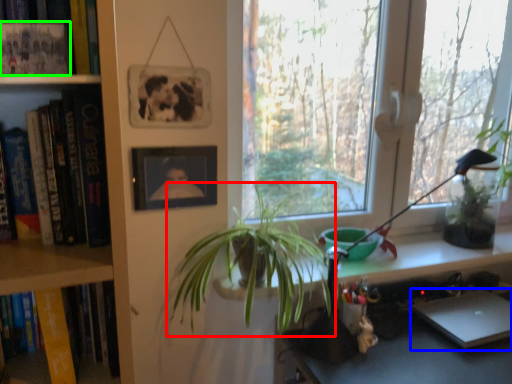
Question: Which object is the closest to the houseplant (highlighted by a red box)? Choose among these: laptop (highlighted by a blue box) or book (highlighted by a green box).

Choices:
 (A) laptop
 (B) book

Answer: (A)